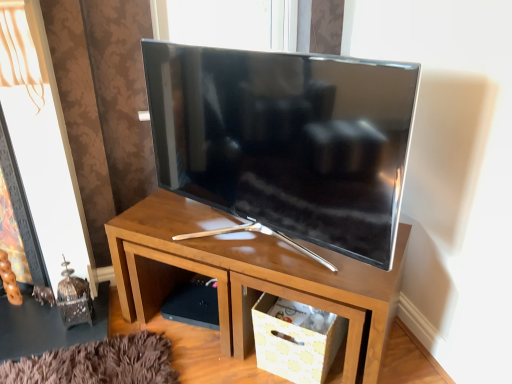
Where is `free space below satin black tv at center (from a real-world perspective)`? free space below satin black tv at center (from a real-world perspective) is located at coordinates pos(240,238).